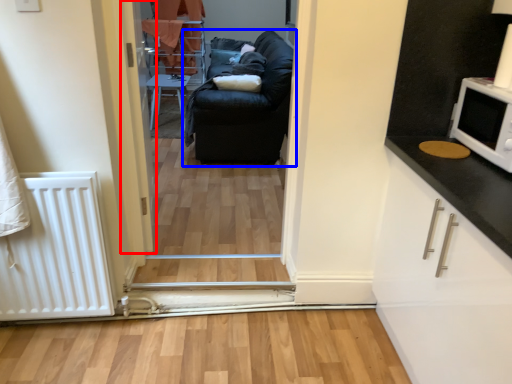
Question: Among these objects, which one is farthest to the camera, door (highlighted by a red box) or studio couch (highlighted by a blue box)?

Choices:
 (A) door
 (B) studio couch

Answer: (B)